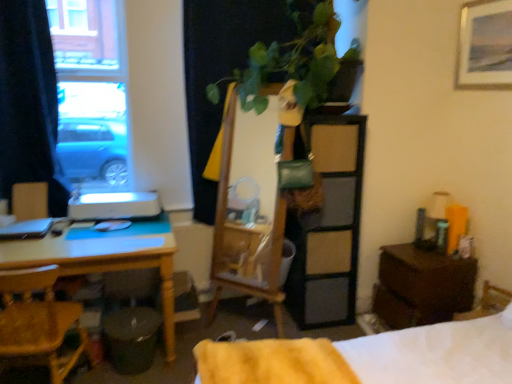
Identify the location of free spot above yellow wood desk at left (from a real-world perspective). (82, 238).